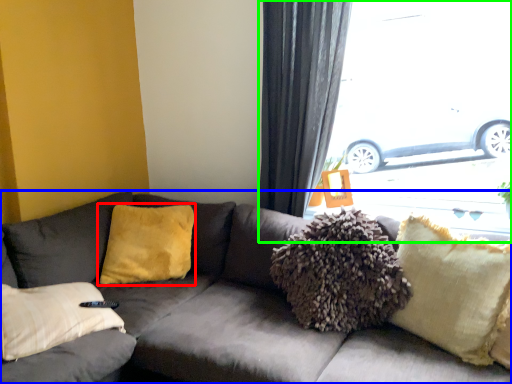
Question: Which is farther away from pillow (highlighted by a red box)? studio couch (highlighted by a blue box) or window (highlighted by a green box)?

Choices:
 (A) studio couch
 (B) window

Answer: (B)